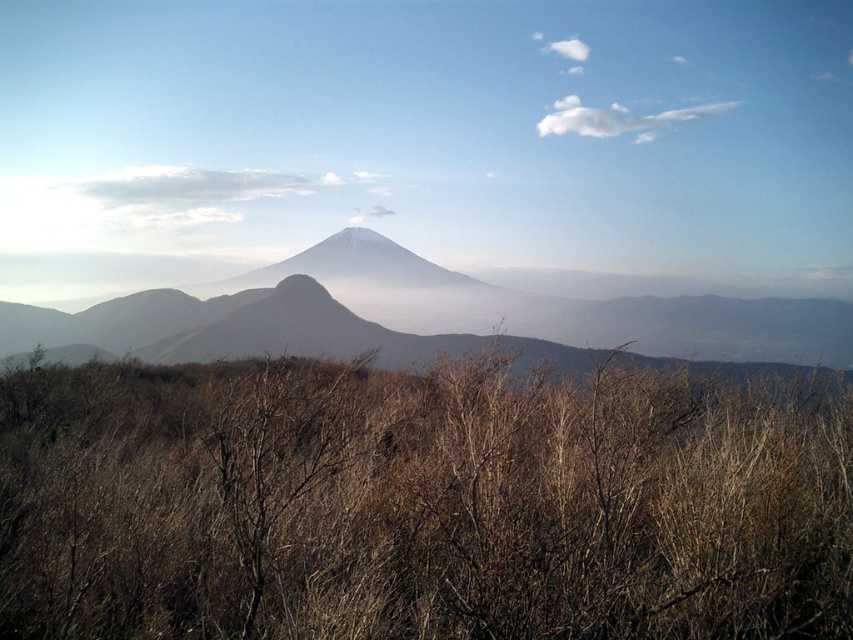
Where is `brown dry bush at center`? Image resolution: width=853 pixels, height=640 pixels. brown dry bush at center is located at coordinates (421, 502).

Measure the distance between brown dry bush at center and camera.

brown dry bush at center is 14.52 feet away from camera.

This screenshot has width=853, height=640. I want to click on brown dry bush at center, so 421,502.

The height and width of the screenshot is (640, 853). I want to click on brown dry bush at center, so click(421, 502).

Can you confirm if white snow-capped mountain at center is shorter than white fluffy cloud at upper center?

No, white snow-capped mountain at center is not shorter than white fluffy cloud at upper center.

Between white snow-capped mountain at center and white fluffy cloud at upper center, which one is positioned higher?

white fluffy cloud at upper center is higher up.

Image resolution: width=853 pixels, height=640 pixels. I want to click on white snow-capped mountain at center, so click(x=457, y=310).

Image resolution: width=853 pixels, height=640 pixels. What are the coordinates of `white snow-capped mountain at center` in the screenshot? It's located at (457, 310).

Is brown dry bush at center further to the viewer compared to white fluffy cloud at upper center?

No.

In the scene shown: Who is more forward, (808, 458) or (614, 115)?

Positioned in front is point (808, 458).

Which is behind, point (654, 502) or point (672, 115)?

The point (672, 115) is behind.

What are the coordinates of `brown dry bush at center` in the screenshot? It's located at (421, 502).